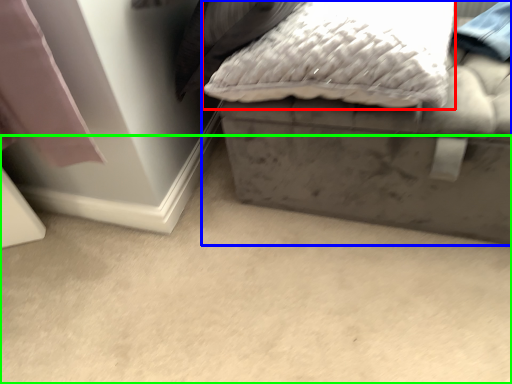
Question: Which is farther away from pillow (highlighted by a red box)? furniture (highlighted by a blue box) or concrete (highlighted by a green box)?

Choices:
 (A) furniture
 (B) concrete

Answer: (B)